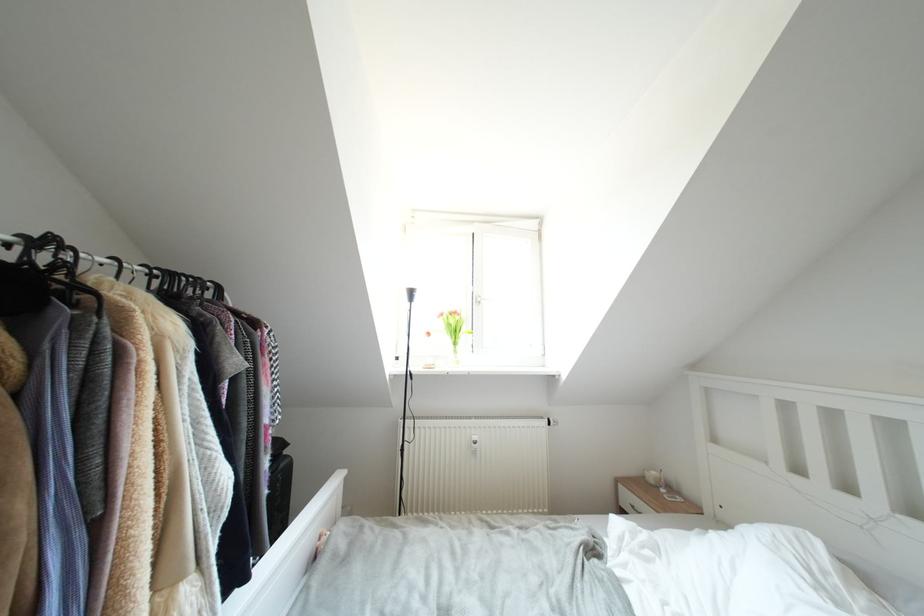
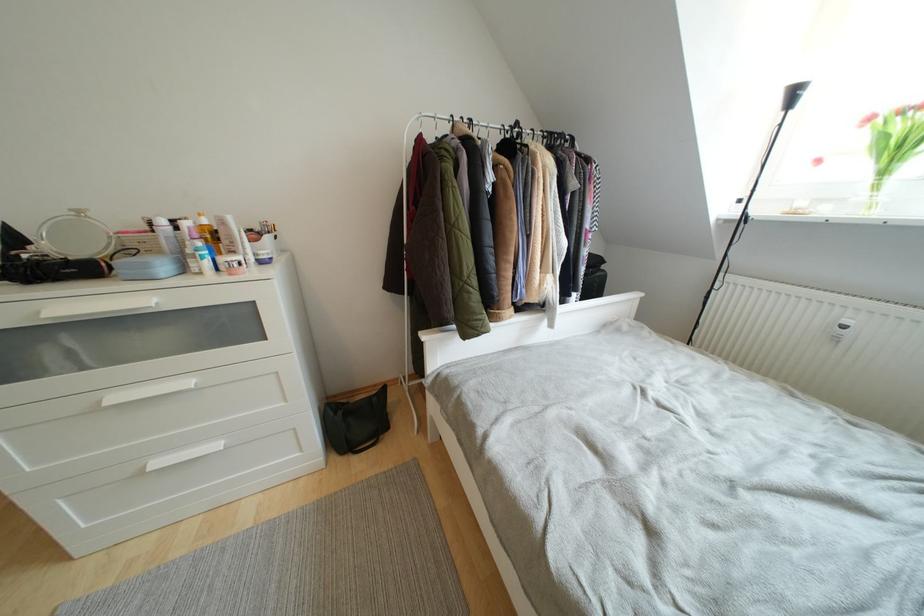
Locate, in the second image, the point that corresponds to the point at 480,442 in the first image.

(853, 326)